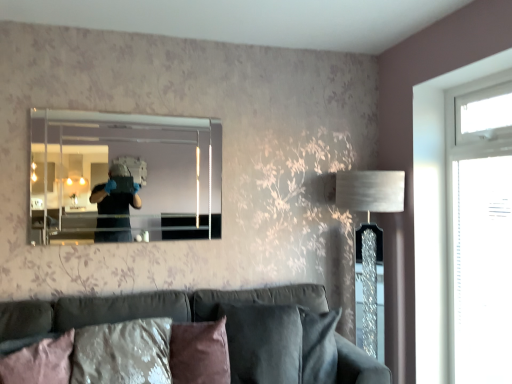
Locate an element on the screen. This screenshot has height=384, width=512. free location above transparent glass window at right (from a real-world perspective) is located at coordinates (479, 79).